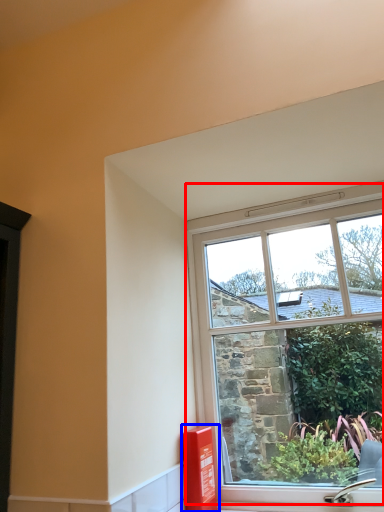
Question: Which of the following is the farthest to the observer, window (highlighted by a red box) or window box (highlighted by a blue box)?

Choices:
 (A) window
 (B) window box

Answer: (B)